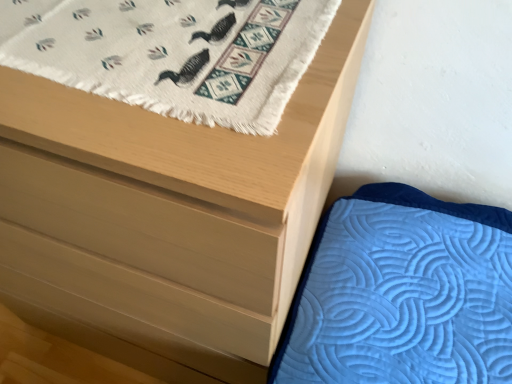
Describe the element at coordinates (168, 217) in the screenshot. The image size is (512, 384). I see `matte wood chest of drawers at upper left` at that location.

Locate an element on the screen. This screenshot has width=512, height=384. matte wood chest of drawers at upper left is located at coordinates (168, 217).

What is the approximate height of matte wood chest of drawers at upper left?

The height of matte wood chest of drawers at upper left is 3.36 feet.

What do you see at coordinates (172, 53) in the screenshot? I see `white woven rug with duck pattern at upper left` at bounding box center [172, 53].

Where is `white woven rug with duck pattern at upper left`? This screenshot has height=384, width=512. white woven rug with duck pattern at upper left is located at coordinates (172, 53).

What is the approximate height of white woven rug with duck pattern at upper left?

It is 2.02 inches.

Image resolution: width=512 pixels, height=384 pixels. I want to click on matte wood chest of drawers at upper left, so click(x=168, y=217).

Does white woven rug with duck pattern at upper left appear on the left side of matte wood chest of drawers at upper left?

No, white woven rug with duck pattern at upper left is not to the left of matte wood chest of drawers at upper left.

In the image, is white woven rug with duck pattern at upper left positioned in front of or behind matte wood chest of drawers at upper left?

Visually, white woven rug with duck pattern at upper left is located behind matte wood chest of drawers at upper left.

Is point (233, 56) behind point (213, 361)?

No, it is in front of (213, 361).

From the image's perspective, is white woven rug with duck pattern at upper left positioned above or below matte wood chest of drawers at upper left?

From the image's perspective, white woven rug with duck pattern at upper left appears above matte wood chest of drawers at upper left.

From a real-world perspective, which object rests below the other?

In real-world perspective, matte wood chest of drawers at upper left is lower.

Which of these two, white woven rug with duck pattern at upper left or matte wood chest of drawers at upper left, is thinner?

white woven rug with duck pattern at upper left.

Considering the relative sizes of white woven rug with duck pattern at upper left and matte wood chest of drawers at upper left in the image provided, is white woven rug with duck pattern at upper left shorter than matte wood chest of drawers at upper left?

Correct, white woven rug with duck pattern at upper left is not as tall as matte wood chest of drawers at upper left.

Which of these two, white woven rug with duck pattern at upper left or matte wood chest of drawers at upper left, is bigger?

matte wood chest of drawers at upper left.

Would you say white woven rug with duck pattern at upper left is inside or outside matte wood chest of drawers at upper left?

white woven rug with duck pattern at upper left fits inside matte wood chest of drawers at upper left.

Can you see white woven rug with duck pattern at upper left touching matte wood chest of drawers at upper left?

No, white woven rug with duck pattern at upper left is not in contact with matte wood chest of drawers at upper left.

Could you tell me if white woven rug with duck pattern at upper left is turned towards matte wood chest of drawers at upper left?

Yes, white woven rug with duck pattern at upper left is aimed at matte wood chest of drawers at upper left.

How many degrees apart are the facing directions of white woven rug with duck pattern at upper left and matte wood chest of drawers at upper left?

The angle between the facing direction of white woven rug with duck pattern at upper left and the facing direction of matte wood chest of drawers at upper left is 2.48 degrees.

Measure the distance between white woven rug with duck pattern at upper left and matte wood chest of drawers at upper left.

The distance of white woven rug with duck pattern at upper left from matte wood chest of drawers at upper left is 7.71 inches.

The image size is (512, 384). I want to click on chest of drawers located on the left of white woven rug with duck pattern at upper left, so click(168, 217).

Does matte wood chest of drawers at upper left appear on the right side of white woven rug with duck pattern at upper left?

Incorrect, matte wood chest of drawers at upper left is not on the right side of white woven rug with duck pattern at upper left.

Considering the relative positions of matte wood chest of drawers at upper left and white woven rug with duck pattern at upper left in the image provided, is matte wood chest of drawers at upper left behind white woven rug with duck pattern at upper left?

No.

Which is behind, point (200, 225) or point (215, 16)?

The point (215, 16) is more distant.

From the image's perspective, is matte wood chest of drawers at upper left located above or below white woven rug with duck pattern at upper left?

matte wood chest of drawers at upper left is situated lower than white woven rug with duck pattern at upper left in the image.

From a real-world perspective, relative to white woven rug with duck pattern at upper left, is matte wood chest of drawers at upper left vertically above or below?

In terms of real-world spatial position, matte wood chest of drawers at upper left is below white woven rug with duck pattern at upper left.

Which object is wider, matte wood chest of drawers at upper left or white woven rug with duck pattern at upper left?

matte wood chest of drawers at upper left is wider.

Which of these two, matte wood chest of drawers at upper left or white woven rug with duck pattern at upper left, stands shorter?

With less height is white woven rug with duck pattern at upper left.

Considering the sizes of objects matte wood chest of drawers at upper left and white woven rug with duck pattern at upper left in the image provided, who is bigger, matte wood chest of drawers at upper left or white woven rug with duck pattern at upper left?

Bigger between the two is matte wood chest of drawers at upper left.

Is matte wood chest of drawers at upper left situated inside white woven rug with duck pattern at upper left or outside?

matte wood chest of drawers at upper left is not inside white woven rug with duck pattern at upper left, it's outside.

Are matte wood chest of drawers at upper left and white woven rug with duck pattern at upper left beside each other?

They are not placed beside each other.

Is matte wood chest of drawers at upper left looking in the opposite direction of white woven rug with duck pattern at upper left?

No, matte wood chest of drawers at upper left is not facing away from white woven rug with duck pattern at upper left.

How different are the orientations of matte wood chest of drawers at upper left and white woven rug with duck pattern at upper left in degrees?

They differ by 2.48 degrees in their facing directions.

You are a GUI agent. You are given a task and a screenshot of the screen. Output one action in this format:
    pyautogui.click(x=<x>, y=<y>)
    Task: Click on the chest of drawers lying on the left of white woven rug with duck pattern at upper left
    The height and width of the screenshot is (384, 512).
    Given the screenshot: What is the action you would take?
    pyautogui.click(x=168, y=217)

The width and height of the screenshot is (512, 384). Find the location of `the chest of drawers that appears below the white woven rug with duck pattern at upper left (from the image's perspective)`. the chest of drawers that appears below the white woven rug with duck pattern at upper left (from the image's perspective) is located at coordinates (168, 217).

Image resolution: width=512 pixels, height=384 pixels. In order to click on blanket that is above the matte wood chest of drawers at upper left (from a real-world perspective) in this screenshot , I will do `click(172, 53)`.